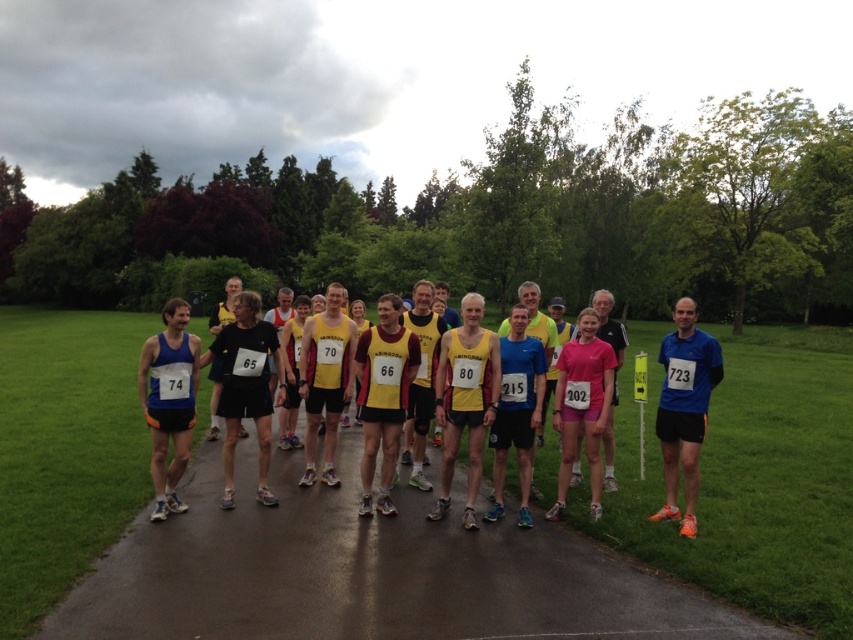
Question: From the image, what is the correct spatial relationship of black asphalt road at center in relation to blue fabric running suit at right?

Choices:
 (A) below
 (B) above

Answer: (A)

Question: Which point is closer to the camera taking this photo?

Choices:
 (A) (107, 572)
 (B) (683, 480)

Answer: (A)

Question: Which point is farther to the camera?

Choices:
 (A) black asphalt road at center
 (B) blue fabric running suit at right

Answer: (B)

Question: Does black asphalt road at center come in front of blue fabric running suit at right?

Choices:
 (A) no
 (B) yes

Answer: (B)

Question: Observing the image, what is the correct spatial positioning of black asphalt road at center in reference to blue fabric running suit at right?

Choices:
 (A) below
 (B) above

Answer: (A)